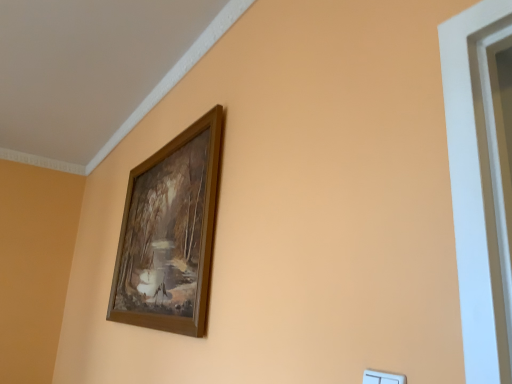
Question: Should I look upward or downward to see white plastic light switch at lower right?

Choices:
 (A) down
 (B) up

Answer: (A)

Question: Considering the relative sizes of white plastic light switch at lower right and wooden frame at upper center in the image provided, is white plastic light switch at lower right bigger than wooden frame at upper center?

Choices:
 (A) yes
 (B) no

Answer: (B)

Question: Is white plastic light switch at lower right positioned with its back to wooden frame at upper center?

Choices:
 (A) yes
 (B) no

Answer: (B)

Question: Is white plastic light switch at lower right to the left of wooden frame at upper center from the viewer's perspective?

Choices:
 (A) no
 (B) yes

Answer: (A)

Question: Is the position of white plastic light switch at lower right less distant than that of wooden frame at upper center?

Choices:
 (A) yes
 (B) no

Answer: (A)

Question: Is white plastic light switch at lower right wider than wooden frame at upper center?

Choices:
 (A) no
 (B) yes

Answer: (A)

Question: From the image's perspective, is white plastic light switch at lower right beneath wooden frame at upper center?

Choices:
 (A) yes
 (B) no

Answer: (A)

Question: Does wooden frame at upper center have a smaller size compared to white plastic light switch at lower right?

Choices:
 (A) yes
 (B) no

Answer: (B)

Question: From the image's perspective, would you say wooden frame at upper center is shown under white plastic light switch at lower right?

Choices:
 (A) yes
 (B) no

Answer: (B)

Question: From a real-world perspective, is wooden frame at upper center under white plastic light switch at lower right?

Choices:
 (A) no
 (B) yes

Answer: (A)

Question: Is wooden frame at upper center shorter than white plastic light switch at lower right?

Choices:
 (A) no
 (B) yes

Answer: (A)

Question: Is wooden frame at upper center at the left side of white plastic light switch at lower right?

Choices:
 (A) no
 (B) yes

Answer: (B)

Question: Can you confirm if wooden frame at upper center is taller than white plastic light switch at lower right?

Choices:
 (A) no
 (B) yes

Answer: (B)

Question: From a real-world perspective, is wooden frame at upper center positioned above or below white plastic light switch at lower right?

Choices:
 (A) below
 (B) above

Answer: (B)